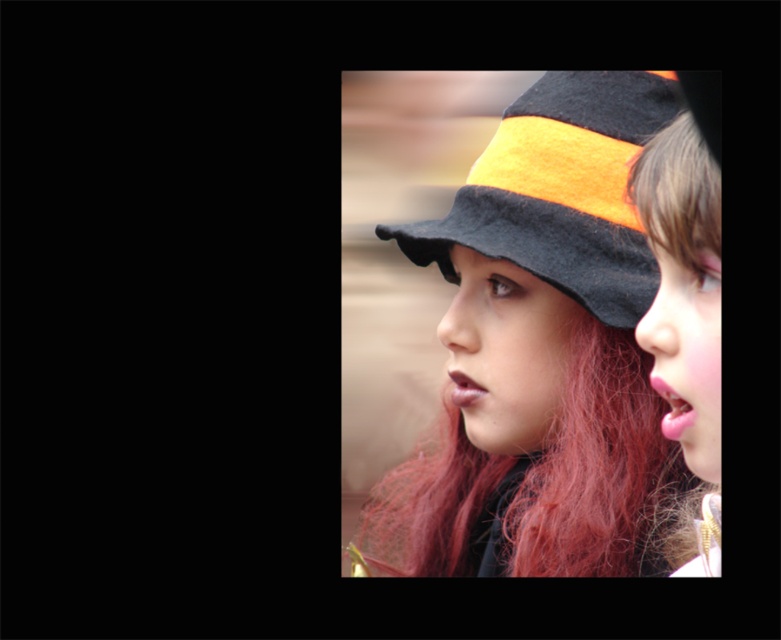
Does matte felt hat at center appear on the left side of orange felt hat at center?

Indeed, matte felt hat at center is positioned on the left side of orange felt hat at center.

Is matte felt hat at center bigger than orange felt hat at center?

Indeed, matte felt hat at center has a larger size compared to orange felt hat at center.

This screenshot has height=640, width=781. Find the location of `matte felt hat at center`. matte felt hat at center is located at coordinates (546, 355).

Between matte felt hat at center and smooth orange hat at right, which one has less height?

smooth orange hat at right is shorter.

Can you confirm if matte felt hat at center is bigger than smooth orange hat at right?

Correct, matte felt hat at center is larger in size than smooth orange hat at right.

Is point (615, 467) positioned before point (708, 518)?

No, it is behind (708, 518).

Find the location of a particular element. matte felt hat at center is located at coordinates point(546,355).

Between orange felt hat at center and smooth orange hat at right, which one has less height?

Standing shorter between the two is orange felt hat at center.

Which is behind, point (508, 221) or point (694, 554)?

Point (508, 221)

This screenshot has width=781, height=640. What do you see at coordinates (560, 192) in the screenshot? I see `orange felt hat at center` at bounding box center [560, 192].

Locate an element on the screen. Image resolution: width=781 pixels, height=640 pixels. orange felt hat at center is located at coordinates (560, 192).